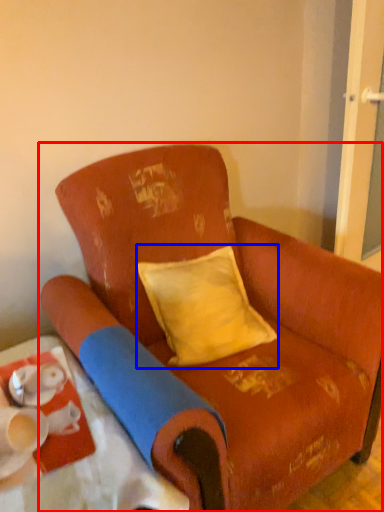
Question: Which object appears farthest to the camera in this image, chair (highlighted by a red box) or pillow (highlighted by a blue box)?

Choices:
 (A) chair
 (B) pillow

Answer: (B)